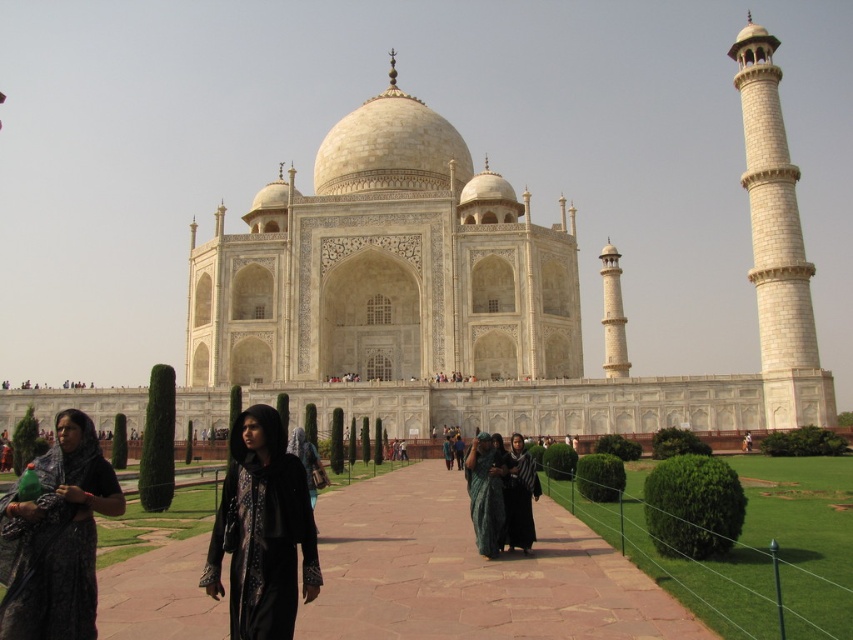
Between brown stone pathway at center and black lace dress at lower left, which one appears on the left side from the viewer's perspective?

Positioned to the left is black lace dress at lower left.

Between brown stone pathway at center and black lace dress at lower left, which one is positioned lower?

brown stone pathway at center

The width and height of the screenshot is (853, 640). What are the coordinates of `brown stone pathway at center` in the screenshot? It's located at (471, 572).

What do you see at coordinates (262, 531) in the screenshot?
I see `black velvet dress at center` at bounding box center [262, 531].

Is point (312, 580) closer to camera compared to point (532, 460)?

Yes, point (312, 580) is closer to viewer.

What are the coordinates of `black velvet dress at center` in the screenshot? It's located at (262, 531).

Find the location of `black velvet dress at center`. black velvet dress at center is located at coordinates (262, 531).

Who is positioned more to the right, black lace dress at lower left or dark gray fabric at center?

Positioned to the right is dark gray fabric at center.

This screenshot has width=853, height=640. What do you see at coordinates (56, 538) in the screenshot? I see `black lace dress at lower left` at bounding box center [56, 538].

Does point (50, 508) come farther from viewer compared to point (521, 516)?

No.

Find the location of `black lace dress at lower left`. black lace dress at lower left is located at coordinates (56, 538).